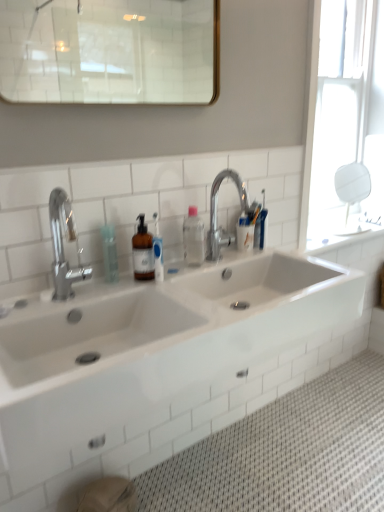
Find the location of a particular element. This screenshot has width=384, height=512. vacant area located to the right-hand side of transparent plastic bottle at center is located at coordinates (158, 284).